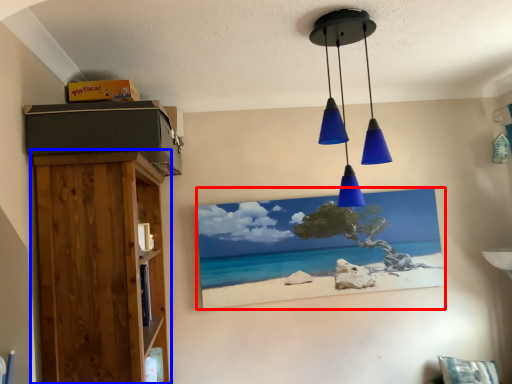
Question: Which object appears closest to the camera in this image, picture frame (highlighted by a red box) or furniture (highlighted by a blue box)?

Choices:
 (A) picture frame
 (B) furniture

Answer: (B)